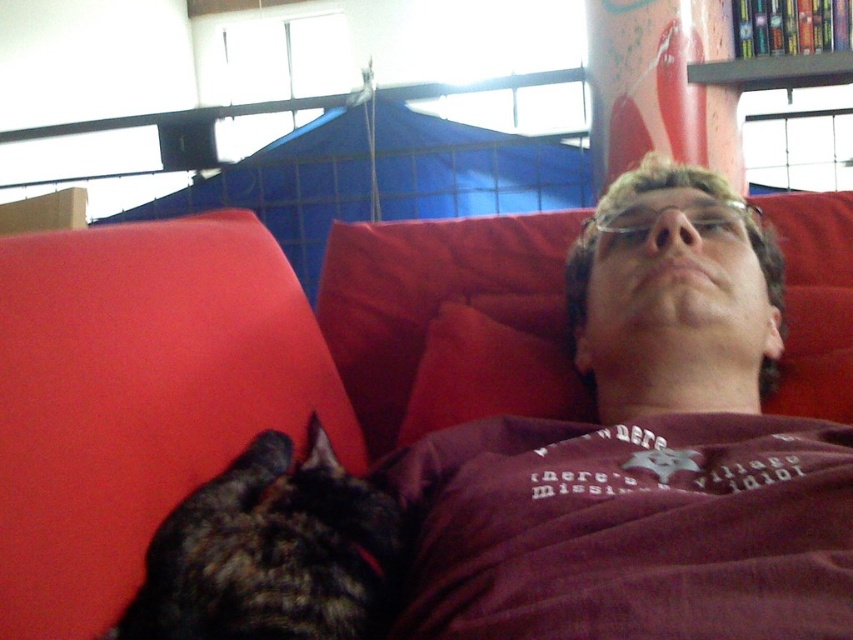
Is red fabric couch at upper center to the left of pink wood bookshelf at upper right from the viewer's perspective?

Indeed, red fabric couch at upper center is positioned on the left side of pink wood bookshelf at upper right.

Can you confirm if red fabric couch at upper center is shorter than pink wood bookshelf at upper right?

No.

Locate an element on the screen. The image size is (853, 640). red fabric couch at upper center is located at coordinates (68, 397).

Does red fabric couch at upper center have a greater width compared to dark fur cat at lower left?

Yes.

Is red fabric couch at upper center positioned in front of dark fur cat at lower left?

Yes.

Does point (15, 534) come behind point (300, 480)?

That is False.

Locate an element on the screen. red fabric couch at upper center is located at coordinates (68, 397).

Does red fabric pillow at upper center appear on the left side of pink wood bookshelf at upper right?

Indeed, red fabric pillow at upper center is positioned on the left side of pink wood bookshelf at upper right.

Can you confirm if red fabric pillow at upper center is shorter than pink wood bookshelf at upper right?

Yes.

Who is more forward, [561,378] or [730,20]?

Positioned in front is point [561,378].

Locate an element on the screen. red fabric pillow at upper center is located at coordinates (486, 376).